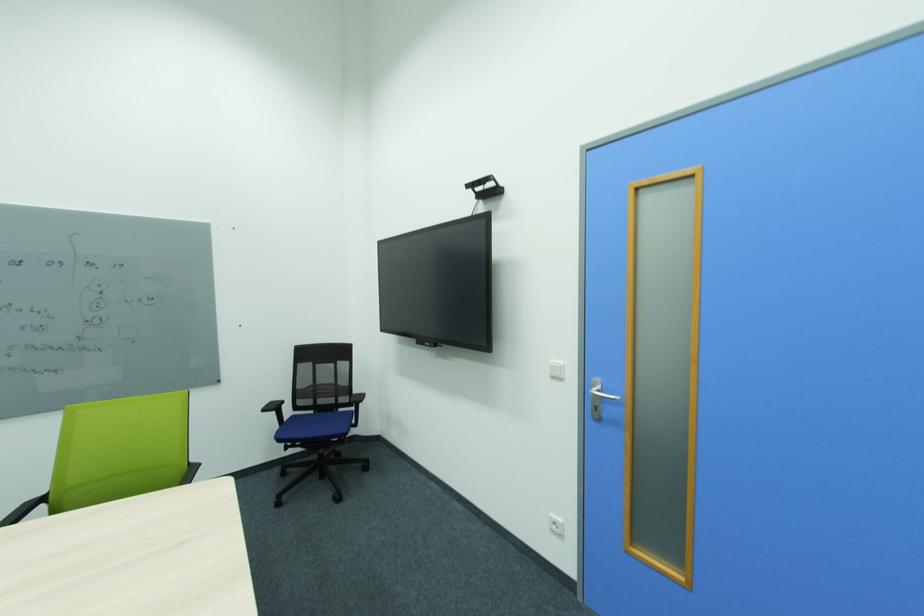
Find where to press the white light switch. Please return your answer as a coordinate pair (x, y).

(555, 370)